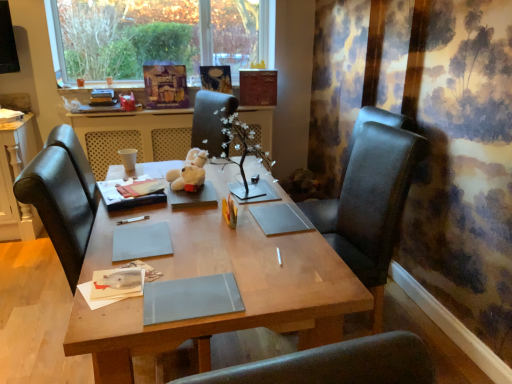
Question: Is white plush bear at center inside the boundaries of black leather chair at right, or outside?

Choices:
 (A) outside
 (B) inside

Answer: (A)

Question: Considering the positions of white plush bear at center and black leather chair at right in the image, is white plush bear at center wider or thinner than black leather chair at right?

Choices:
 (A) thin
 (B) wide

Answer: (A)

Question: Which object is positioned farthest from the wooden table at center?

Choices:
 (A) wooden desk at center
 (B) black leather chair at right
 (C) white plush bear at center
 (D) matte gray notebook at center, which is counted as the first notebook, starting from the bottom
 (E) gray matte notebook at center, which is the 2th notebook from right to left

Answer: (D)

Question: Estimate the real-world distances between objects in this image. Which object is farther from the black leather chair at right?

Choices:
 (A) matte paper book at center
 (B) matte gray notebook at center, which is counted as the first notebook, starting from the bottom
 (C) wooden desk at center
 (D) wooden table at center
 (E) gray matte notebook at center, the second notebook when ordered from front to back

Answer: (D)